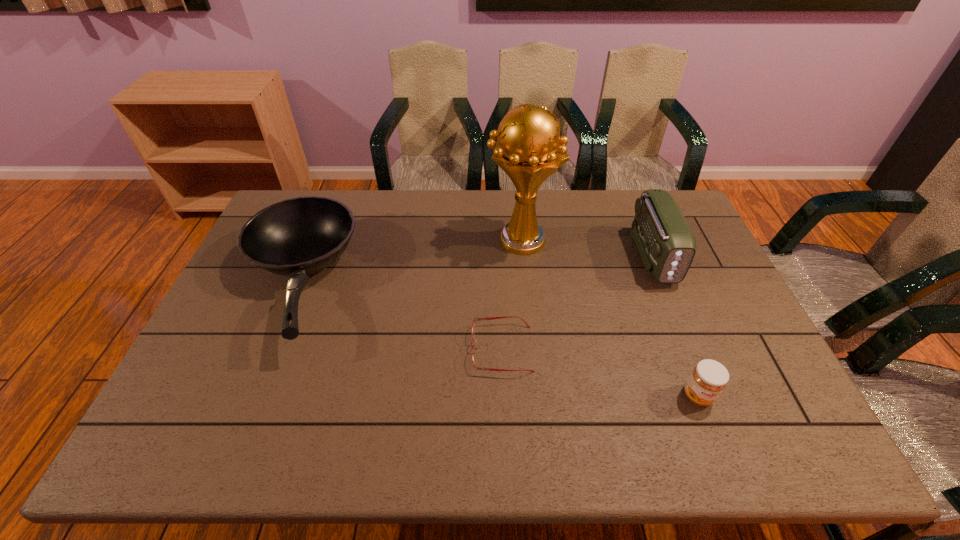
This screenshot has height=540, width=960. I want to click on free location that satisfies the following two spatial constraints: 1. at the front of the trophy_cup where the globe is prominent; 2. on the front side of the frying pan, so click(x=524, y=284).